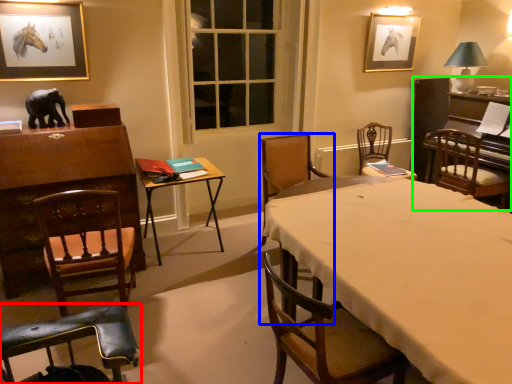
Question: Estimate the real-world distances between objects in this image. Which object is closer to chair (highlighted by a red box), chair (highlighted by a blue box) or piano (highlighted by a green box)?

Choices:
 (A) chair
 (B) piano

Answer: (A)